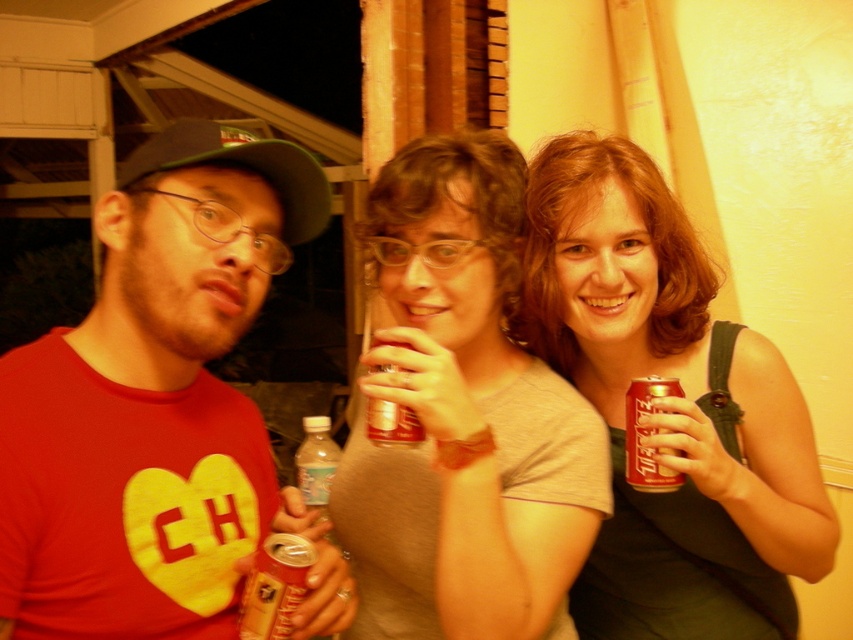
Who is positioned more to the left, metallic gold can at center or metallic silver can at center?

From the viewer's perspective, metallic gold can at center appears more on the left side.

In the scene shown: Can you confirm if metallic gold can at center is bigger than metallic silver can at center?

No, metallic gold can at center is not bigger than metallic silver can at center.

Describe the element at coordinates (276, 586) in the screenshot. I see `metallic gold can at center` at that location.

You are a GUI agent. You are given a task and a screenshot of the screen. Output one action in this format:
    pyautogui.click(x=<x>, y=<y>)
    Task: Click on the metallic gold can at center
    The height and width of the screenshot is (640, 853).
    Given the screenshot: What is the action you would take?
    pyautogui.click(x=276, y=586)

Is matte gray shirt at center above matte plastic soda can at center?

Yes.

You are a GUI agent. You are given a task and a screenshot of the screen. Output one action in this format:
    pyautogui.click(x=<x>, y=<y>)
    Task: Click on the matte gray shirt at center
    This screenshot has width=853, height=640.
    Given the screenshot: What is the action you would take?
    [x=463, y=417]

You are a GUI agent. You are given a task and a screenshot of the screen. Output one action in this format:
    pyautogui.click(x=<x>, y=<y>)
    Task: Click on the matte gray shirt at center
    The image size is (853, 640).
    Given the screenshot: What is the action you would take?
    pyautogui.click(x=463, y=417)

Between shiny red can at center and matte plastic soda can at center, which one is positioned higher?

matte plastic soda can at center is higher up.

Is shiny red can at center closer to the viewer compared to matte plastic soda can at center?

No.

Where is `shiny red can at center`? shiny red can at center is located at coordinates click(670, 406).

You are a GUI agent. You are given a task and a screenshot of the screen. Output one action in this format:
    pyautogui.click(x=<x>, y=<y>)
    Task: Click on the shiny red can at center
    This screenshot has width=853, height=640.
    Given the screenshot: What is the action you would take?
    pyautogui.click(x=670, y=406)